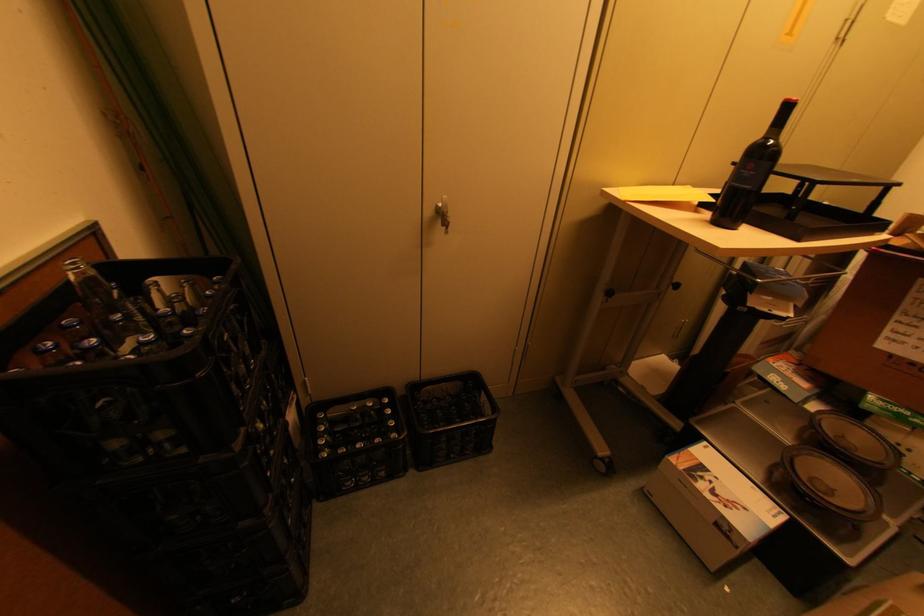
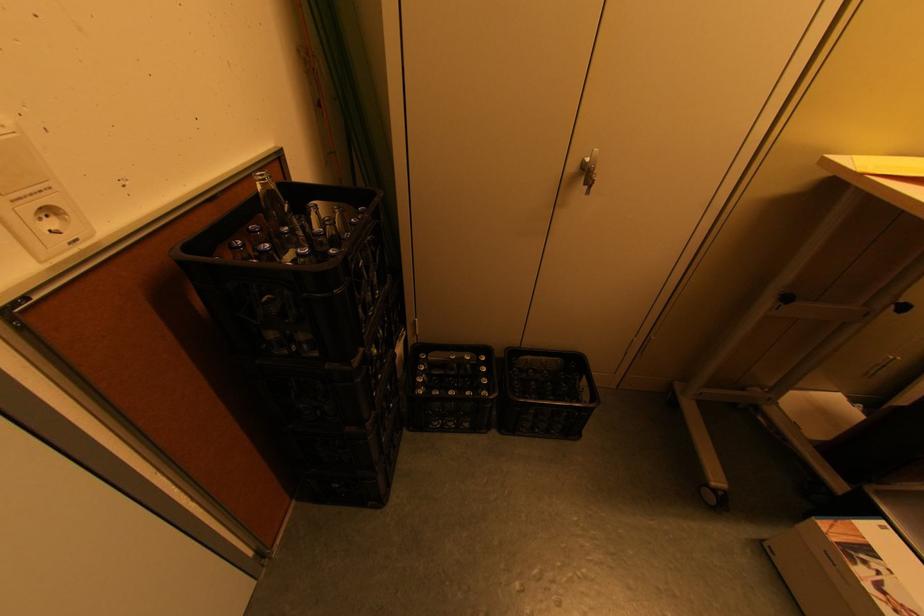
The point at (144, 318) is marked in the first image. Where is the corresponding point in the second image?

(304, 233)